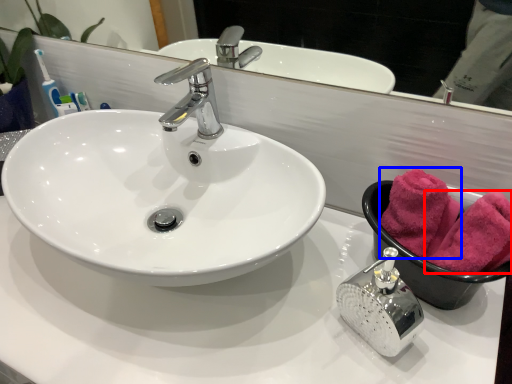
Question: Which point is closer to the camera, bath towel (highlighted by a red box) or bath towel (highlighted by a blue box)?

Choices:
 (A) bath towel
 (B) bath towel

Answer: (A)